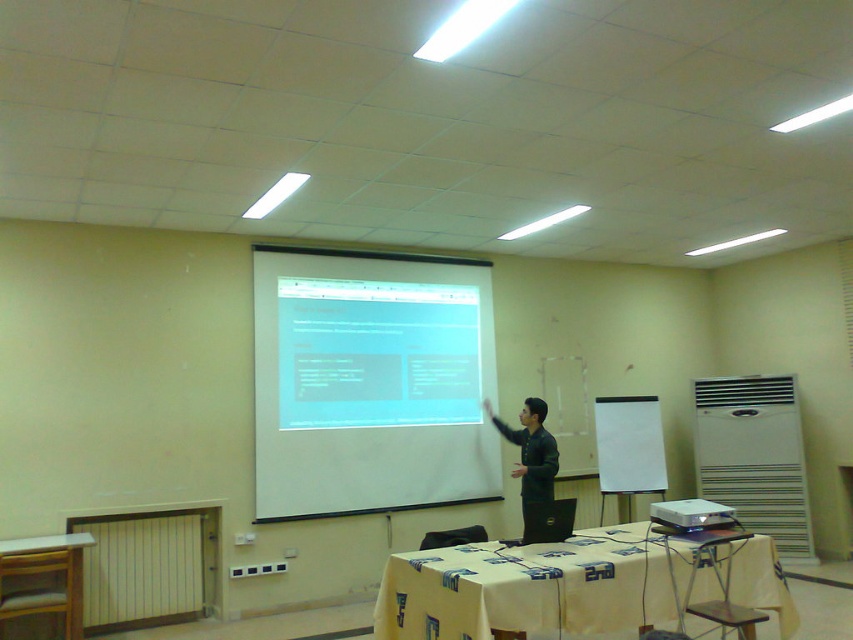
Question: Does white matte projection screen at center have a smaller size compared to green matte jacket at center?

Choices:
 (A) yes
 (B) no

Answer: (B)

Question: Is wooden table at lower left wider than green matte jacket at center?

Choices:
 (A) no
 (B) yes

Answer: (B)

Question: Does white matte projection screen at center come behind green matte jacket at center?

Choices:
 (A) yes
 (B) no

Answer: (A)

Question: Which point is closer to the camera?

Choices:
 (A) white plastic projector at center
 (B) wooden table at lower left
 (C) white matte projection screen at center
 (D) green matte jacket at center

Answer: (A)

Question: Which point is farther to the camera?

Choices:
 (A) white fabric table at lower center
 (B) wooden table at lower left

Answer: (B)

Question: Among these points, which one is farthest from the camera?

Choices:
 (A) (585, 563)
 (B) (712, 513)
 (C) (531, 460)

Answer: (C)